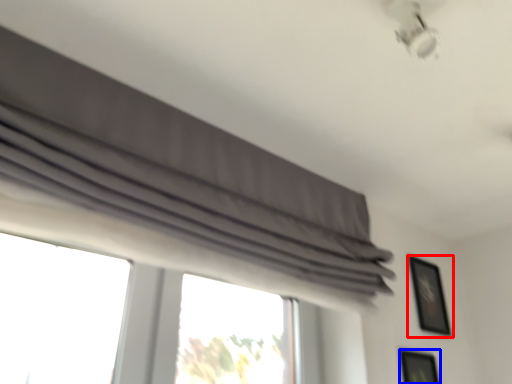
Question: Among these objects, which one is farthest to the camera, picture frame (highlighted by a red box) or picture frame (highlighted by a blue box)?

Choices:
 (A) picture frame
 (B) picture frame

Answer: (A)